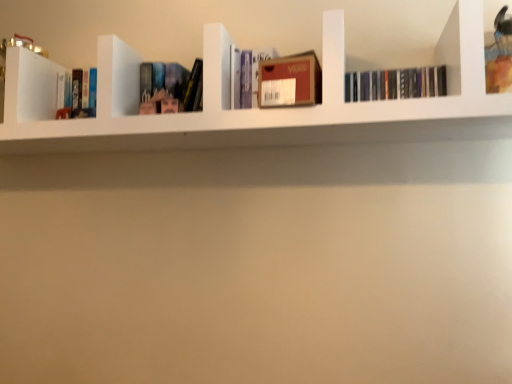
Question: In terms of height, does black matte books at upper right, which ranks as the first book in right-to-left order, look taller or shorter compared to hardcover book at left, which is the 1th book from left to right?

Choices:
 (A) short
 (B) tall

Answer: (A)

Question: Is black matte books at upper right, which ranks as the first book in right-to-left order, bigger or smaller than hardcover book at left, which is the 1th book from left to right?

Choices:
 (A) big
 (B) small

Answer: (B)

Question: Which is nearer to the black matte books at upper right, the 5th book in the left-to-right sequence?

Choices:
 (A) matte plastic book at center, which ranks as the 4th book in right-to-left order
 (B) matte cardboard box at center, acting as the 3th book starting from the right
 (C) white matte bookshelf at upper center
 (D) hardcover book at left, which is the 1th book from left to right
 (E) brown cardboard box at center, placed as the 4th book when sorted from left to right

Answer: (E)

Question: Estimate the real-world distances between objects in this image. Which object is farther from the matte cardboard box at center, acting as the 3th book starting from the right?

Choices:
 (A) hardcover book at left, the 5th book when ordered from right to left
 (B) brown cardboard box at center, placed as the 4th book when sorted from left to right
 (C) black matte books at upper right, which ranks as the first book in right-to-left order
 (D) matte plastic book at center, the 2th book positioned from the left
 (E) white matte bookshelf at upper center

Answer: (A)